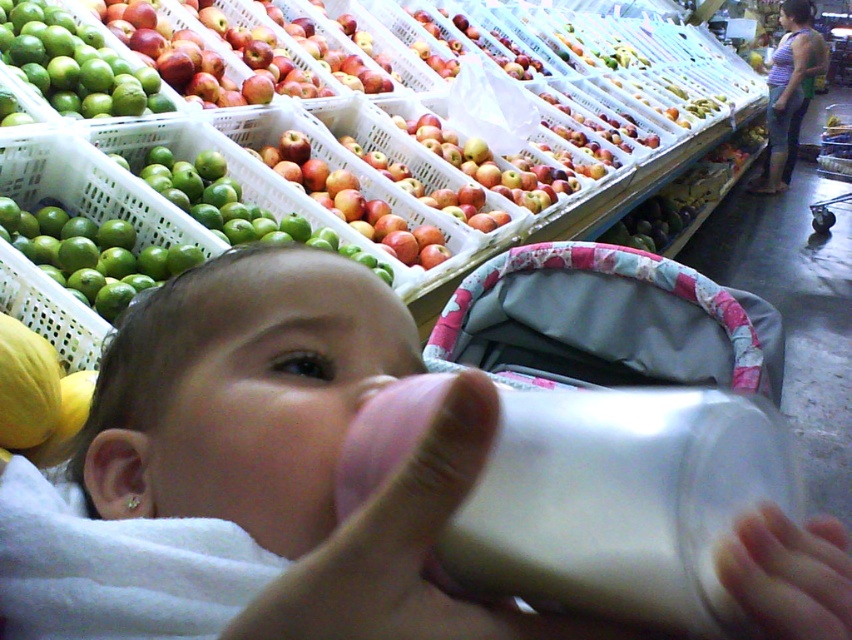
Question: Which of the following is the farthest from the observer?

Choices:
 (A) green matte apple at center
 (B) green matte apples at upper left
 (C) shiny red apples at center
 (D) transparent plastic bottle at center

Answer: (C)

Question: Which object is the closest to the green matte apple at center?

Choices:
 (A) transparent plastic bottle at center
 (B) green matte limes at left

Answer: (B)

Question: Does green matte limes at left appear on the left side of green matte apple at center?

Choices:
 (A) yes
 (B) no

Answer: (A)

Question: Which point appears farthest from the camera in this image?

Choices:
 (A) (661, 524)
 (B) (193, 186)
 (C) (309, 152)

Answer: (C)

Question: Is transparent plastic bottle at center to the right of green matte apple at center from the viewer's perspective?

Choices:
 (A) no
 (B) yes

Answer: (B)

Question: Does transparent plastic bottle at center have a lesser width compared to shiny red apples at center?

Choices:
 (A) yes
 (B) no

Answer: (A)